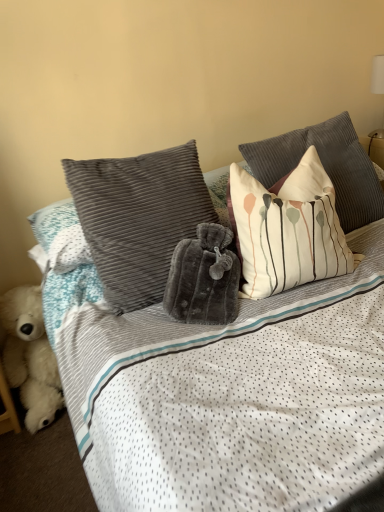
What is the approximate width of white fluffy teddy bear at lower left?

The width of white fluffy teddy bear at lower left is 12.93 inches.

The height and width of the screenshot is (512, 384). In order to click on white cotton pillow with abstract design at upper right, positioned as the third pillow in left-to-right order in this screenshot , I will do `click(324, 166)`.

Locate an element on the screen. The width and height of the screenshot is (384, 512). white fluffy teddy bear at lower left is located at coordinates (30, 356).

From a real-world perspective, is white striped pillow at upper right, marked as the 2th pillow in a left-to-right arrangement, beneath white fluffy teddy bear at lower left?

No, from a real-world perspective, white striped pillow at upper right, marked as the 2th pillow in a left-to-right arrangement, is not below white fluffy teddy bear at lower left.

Is point (257, 189) closer or farther from the camera than point (0, 301)?

Clearly, point (257, 189) is closer to the camera than point (0, 301).

Is white striped pillow at upper right, which is counted as the 2th pillow, starting from the right, to the left or to the right of white fluffy teddy bear at lower left in the image?

Clearly, white striped pillow at upper right, which is counted as the 2th pillow, starting from the right, is on the right of white fluffy teddy bear at lower left in the image.

From the image's perspective, is white striped pillow at upper right, which is counted as the 2th pillow, starting from the right, located above white fluffy teddy bear at lower left?

Indeed, from the image's perspective, white striped pillow at upper right, which is counted as the 2th pillow, starting from the right, is shown above white fluffy teddy bear at lower left.

How distant is white fluffy teddy bear at lower left from white striped pillow at upper right, which is counted as the 2th pillow, starting from the right?

The distance of white fluffy teddy bear at lower left from white striped pillow at upper right, which is counted as the 2th pillow, starting from the right, is 35.53 inches.

Does point (8, 381) come behind point (334, 211)?

Yes, it is.

The height and width of the screenshot is (512, 384). What are the coordinates of `teddy bear below the white striped pillow at upper right, marked as the 2th pillow in a left-to-right arrangement (from a real-world perspective)` in the screenshot? It's located at (30, 356).

Between white cotton pillow with abstract design at upper right, positioned as the third pillow in left-to-right order, and white fluffy teddy bear at lower left, which one has smaller width?

white cotton pillow with abstract design at upper right, positioned as the third pillow in left-to-right order, is thinner.

Considering the relative sizes of white cotton pillow with abstract design at upper right, positioned as the third pillow in left-to-right order, and white fluffy teddy bear at lower left in the image provided, is white cotton pillow with abstract design at upper right, positioned as the third pillow in left-to-right order, taller than white fluffy teddy bear at lower left?

Yes, white cotton pillow with abstract design at upper right, positioned as the third pillow in left-to-right order, is taller than white fluffy teddy bear at lower left.

Which is more to the right, white cotton pillow with abstract design at upper right, positioned as the third pillow in left-to-right order, or white fluffy teddy bear at lower left?

white cotton pillow with abstract design at upper right, positioned as the third pillow in left-to-right order.

At what (x,y) coordinates should I click in order to perform the action: click on teddy bear behind the white cotton pillow with abstract design at upper right, positioned as the third pillow in left-to-right order. Please return your answer as a coordinate pair (x, y). Looking at the image, I should click on (30, 356).

Considering the sizes of objects white cotton pillow with abstract design at upper right, which is the 1th pillow from right to left, and velvety gray pillow at center, which appears as the first pillow when viewed from the left, in the image provided, who is bigger, white cotton pillow with abstract design at upper right, which is the 1th pillow from right to left, or velvety gray pillow at center, which appears as the first pillow when viewed from the left,?

white cotton pillow with abstract design at upper right, which is the 1th pillow from right to left.

In terms of width, does white cotton pillow with abstract design at upper right, which is the 1th pillow from right to left, look wider or thinner when compared to velvety gray pillow at center, which appears as the first pillow when viewed from the left?

Clearly, white cotton pillow with abstract design at upper right, which is the 1th pillow from right to left, has more width compared to velvety gray pillow at center, which appears as the first pillow when viewed from the left.

Between white cotton pillow with abstract design at upper right, which is the 1th pillow from right to left, and velvety gray pillow at center, which appears as the first pillow when viewed from the left, which one appears on the left side from the viewer's perspective?

Positioned to the left is velvety gray pillow at center, which appears as the first pillow when viewed from the left.

Considering the relative sizes of velvety gray pillow at center, placed as the 3th pillow when sorted from right to left, and white cotton pillow with abstract design at upper right, which is the 1th pillow from right to left, in the image provided, is velvety gray pillow at center, placed as the 3th pillow when sorted from right to left, smaller than white cotton pillow with abstract design at upper right, which is the 1th pillow from right to left,?

Correct, velvety gray pillow at center, placed as the 3th pillow when sorted from right to left, occupies less space than white cotton pillow with abstract design at upper right, which is the 1th pillow from right to left.

Which object is wider, velvety gray pillow at center, placed as the 3th pillow when sorted from right to left, or white cotton pillow with abstract design at upper right, positioned as the third pillow in left-to-right order?

white cotton pillow with abstract design at upper right, positioned as the third pillow in left-to-right order.

Could white cotton pillow with abstract design at upper right, which is the 1th pillow from right to left, be considered to be inside velvety gray pillow at center, placed as the 3th pillow when sorted from right to left?

Definitely not — white cotton pillow with abstract design at upper right, which is the 1th pillow from right to left, is not inside velvety gray pillow at center, placed as the 3th pillow when sorted from right to left.

How many degrees apart are the facing directions of white striped pillow at upper right, marked as the 2th pillow in a left-to-right arrangement, and velvety gray pillow at center, which appears as the first pillow when viewed from the left?

The facing directions of white striped pillow at upper right, marked as the 2th pillow in a left-to-right arrangement, and velvety gray pillow at center, which appears as the first pillow when viewed from the left, are 15.2 degrees apart.

From the image's perspective, which pillow is the 1st one above the velvety gray pillow at center, which appears as the first pillow when viewed from the left? Please provide its 2D coordinates.

[(287, 229)]

Would you say white striped pillow at upper right, which is counted as the 2th pillow, starting from the right, is outside velvety gray pillow at center, placed as the 3th pillow when sorted from right to left?

white striped pillow at upper right, which is counted as the 2th pillow, starting from the right, lies outside velvety gray pillow at center, placed as the 3th pillow when sorted from right to left,'s area.

In the scene shown: From the image's perspective, is white striped pillow at upper right, marked as the 2th pillow in a left-to-right arrangement, under velvety gray pillow at center, which appears as the first pillow when viewed from the left?

No, from the image's perspective, white striped pillow at upper right, marked as the 2th pillow in a left-to-right arrangement, is not below velvety gray pillow at center, which appears as the first pillow when viewed from the left.

From the picture: Which is in front, white fluffy teddy bear at lower left or velvety gray pillow at center, which appears as the first pillow when viewed from the left?

velvety gray pillow at center, which appears as the first pillow when viewed from the left, is closer to the camera.

Can you confirm if white fluffy teddy bear at lower left is shorter than velvety gray pillow at center, which appears as the first pillow when viewed from the left?

Yes, white fluffy teddy bear at lower left is shorter than velvety gray pillow at center, which appears as the first pillow when viewed from the left.

Looking at this image, considering the relative sizes of white fluffy teddy bear at lower left and velvety gray pillow at center, placed as the 3th pillow when sorted from right to left, in the image provided, is white fluffy teddy bear at lower left wider than velvety gray pillow at center, placed as the 3th pillow when sorted from right to left,?

Yes, white fluffy teddy bear at lower left is wider than velvety gray pillow at center, placed as the 3th pillow when sorted from right to left.

Where is `teddy bear located underneath the white striped pillow at upper right, which is counted as the 2th pillow, starting from the right (from a real-world perspective)`? teddy bear located underneath the white striped pillow at upper right, which is counted as the 2th pillow, starting from the right (from a real-world perspective) is located at coordinates (30, 356).

Identify the location of the 2nd pillow in front of the white fluffy teddy bear at lower left. (287, 229).

From the image, which object appears to be farther from white fluffy teddy bear at lower left, velvety gray pillow at center, placed as the 3th pillow when sorted from right to left, or white cotton pillow with abstract design at upper right, which is the 1th pillow from right to left?

Among the two, white cotton pillow with abstract design at upper right, which is the 1th pillow from right to left, is located further to white fluffy teddy bear at lower left.

Estimate the real-world distances between objects in this image. Which object is closer to white striped pillow at upper right, which is counted as the 2th pillow, starting from the right, white cotton pillow with abstract design at upper right, positioned as the third pillow in left-to-right order, or velvety gray pillow at center, placed as the 3th pillow when sorted from right to left?

Based on the image, white cotton pillow with abstract design at upper right, positioned as the third pillow in left-to-right order, appears to be nearer to white striped pillow at upper right, which is counted as the 2th pillow, starting from the right.

Estimate the real-world distances between objects in this image. Which object is further from velvety gray pillow at center, which appears as the first pillow when viewed from the left, white cotton pillow with abstract design at upper right, positioned as the third pillow in left-to-right order, or white striped pillow at upper right, which is counted as the 2th pillow, starting from the right?

white cotton pillow with abstract design at upper right, positioned as the third pillow in left-to-right order, is positioned further to the anchor velvety gray pillow at center, which appears as the first pillow when viewed from the left.

Looking at the image, which one is located closer to white fluffy teddy bear at lower left, white cotton pillow with abstract design at upper right, positioned as the third pillow in left-to-right order, or white striped pillow at upper right, marked as the 2th pillow in a left-to-right arrangement?

The object closer to white fluffy teddy bear at lower left is white striped pillow at upper right, marked as the 2th pillow in a left-to-right arrangement.

When comparing their distances from white fluffy teddy bear at lower left, does white striped pillow at upper right, marked as the 2th pillow in a left-to-right arrangement, or white cotton pillow with abstract design at upper right, which is the 1th pillow from right to left, seem closer?

white striped pillow at upper right, marked as the 2th pillow in a left-to-right arrangement.

When comparing their distances from white cotton pillow with abstract design at upper right, which is the 1th pillow from right to left, does white striped pillow at upper right, which is counted as the 2th pillow, starting from the right, or white fluffy teddy bear at lower left seem closer?

The object closer to white cotton pillow with abstract design at upper right, which is the 1th pillow from right to left, is white striped pillow at upper right, which is counted as the 2th pillow, starting from the right.

When comparing their distances from velvety gray pillow at center, placed as the 3th pillow when sorted from right to left, does white striped pillow at upper right, marked as the 2th pillow in a left-to-right arrangement, or white cotton pillow with abstract design at upper right, which is the 1th pillow from right to left, seem closer?

The object closer to velvety gray pillow at center, placed as the 3th pillow when sorted from right to left, is white striped pillow at upper right, marked as the 2th pillow in a left-to-right arrangement.

Considering their positions, is white striped pillow at upper right, which is counted as the 2th pillow, starting from the right, positioned closer to white fluffy teddy bear at lower left than velvety gray pillow at center, placed as the 3th pillow when sorted from right to left?

Among the two, velvety gray pillow at center, placed as the 3th pillow when sorted from right to left, is located nearer to white fluffy teddy bear at lower left.

You are a GUI agent. You are given a task and a screenshot of the screen. Output one action in this format:
    pyautogui.click(x=<x>, y=<y>)
    Task: Click on the pillow between velvety gray pillow at center, placed as the 3th pillow when sorted from right to left, and white cotton pillow with abstract design at upper right, positioned as the third pillow in left-to-right order
    The image size is (384, 512).
    Given the screenshot: What is the action you would take?
    pyautogui.click(x=287, y=229)

The image size is (384, 512). I want to click on pillow between white fluffy teddy bear at lower left and white striped pillow at upper right, marked as the 2th pillow in a left-to-right arrangement, so click(138, 218).